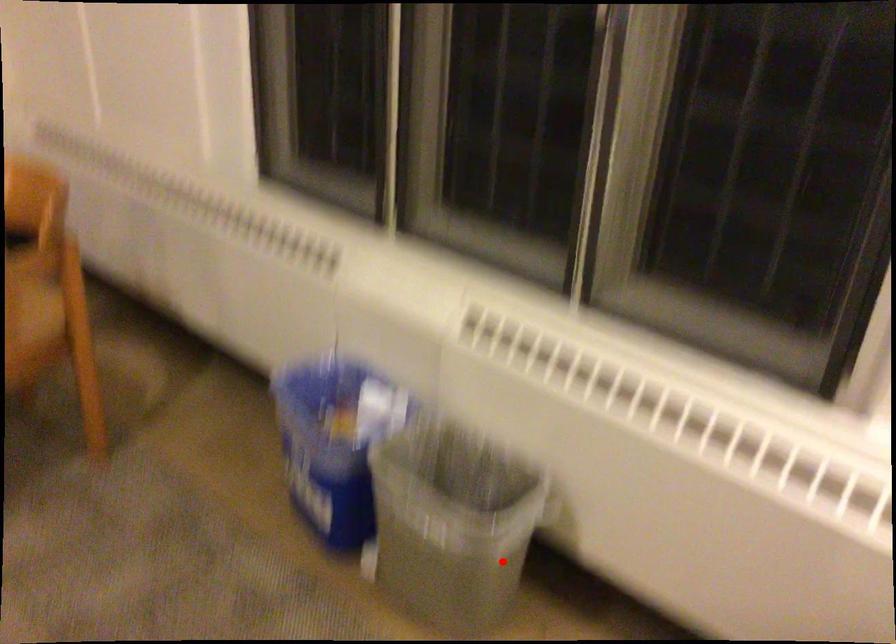
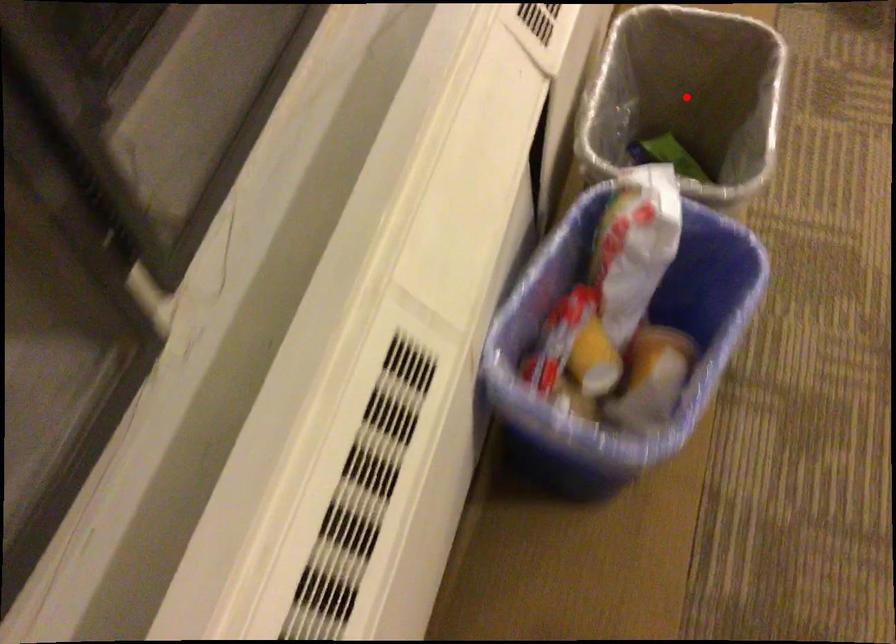
Based on the photo, I am providing you with two images of the same scene from different viewpoints. A red point is marked on the first image and another point is marked on the second image. Is the red point in image1 aligned with the point shown in image2?

Yes